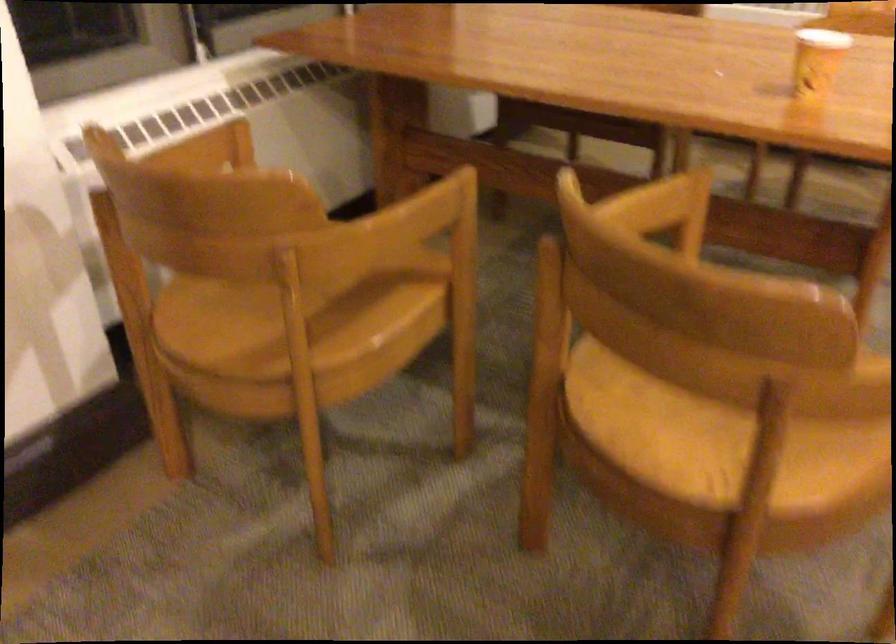
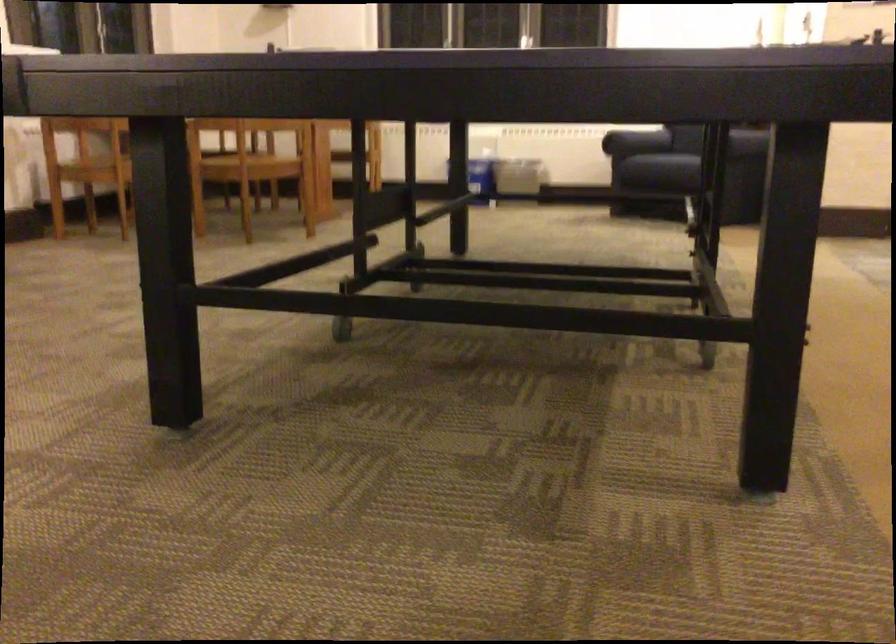
Question: I am providing you with two images of the same scene from different viewpoints. Please identify which objects are invisible in image2.

Choices:
 (A) yellow paper cup
 (B) chair sitting surface
 (C) sofa armrest
 (D) beige light switch

Answer: (A)